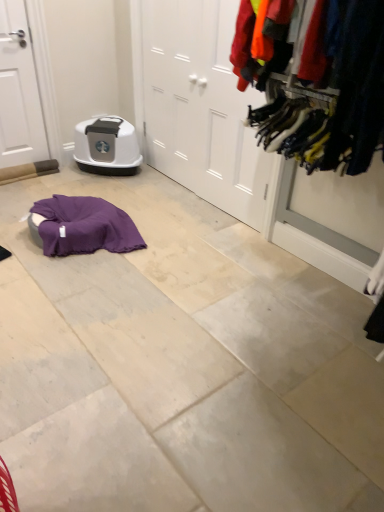
Question: Is white matte door at left, acting as the 1th door starting from the left, directly adjacent to matte gray plastic litter box at center?

Choices:
 (A) no
 (B) yes

Answer: (A)

Question: Does white matte door at left, acting as the 1th door starting from the left, have a greater width compared to matte gray plastic litter box at center?

Choices:
 (A) yes
 (B) no

Answer: (B)

Question: Can you confirm if white matte door at left, positioned as the second door in right-to-left order, is positioned to the right of matte gray plastic litter box at center?

Choices:
 (A) yes
 (B) no

Answer: (B)

Question: From a real-world perspective, is white matte door at left, positioned as the second door in right-to-left order, on top of matte gray plastic litter box at center?

Choices:
 (A) yes
 (B) no

Answer: (A)

Question: Does white matte door at left, positioned as the second door in right-to-left order, have a lesser height compared to matte gray plastic litter box at center?

Choices:
 (A) no
 (B) yes

Answer: (A)

Question: Is white matte door at center, acting as the first door starting from the right, in front of or behind matte gray plastic litter box at center in the image?

Choices:
 (A) front
 (B) behind

Answer: (A)

Question: Looking at the image, does white matte door at center, positioned as the second door in left-to-right order, seem bigger or smaller compared to matte gray plastic litter box at center?

Choices:
 (A) small
 (B) big

Answer: (B)

Question: Based on their positions, is white matte door at center, positioned as the second door in left-to-right order, located to the left or right of matte gray plastic litter box at center?

Choices:
 (A) left
 (B) right

Answer: (B)

Question: Is point (180, 40) closer or farther from the camera than point (94, 126)?

Choices:
 (A) closer
 (B) farther

Answer: (A)

Question: Is white matte door at left, acting as the 1th door starting from the left, spatially inside white matte door at center, positioned as the second door in left-to-right order, or outside of it?

Choices:
 (A) inside
 (B) outside

Answer: (B)

Question: Looking at the image, does white matte door at left, acting as the 1th door starting from the left, seem bigger or smaller compared to white matte door at center, acting as the first door starting from the right?

Choices:
 (A) big
 (B) small

Answer: (B)

Question: Based on their positions, is white matte door at left, acting as the 1th door starting from the left, located to the left or right of white matte door at center, positioned as the second door in left-to-right order?

Choices:
 (A) right
 (B) left

Answer: (B)

Question: Does point (3, 4) appear closer or farther from the camera than point (157, 51)?

Choices:
 (A) farther
 (B) closer

Answer: (B)

Question: From a real-world perspective, is textured fabric clothes at right physically located above or below matte gray plastic litter box at center?

Choices:
 (A) above
 (B) below

Answer: (A)

Question: From the image's perspective, is textured fabric clothes at right located above or below matte gray plastic litter box at center?

Choices:
 (A) above
 (B) below

Answer: (B)